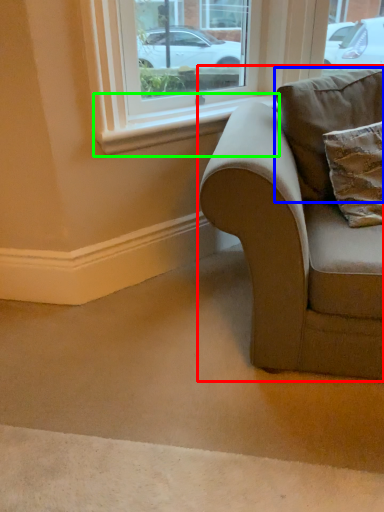
Question: Which is farther away from studio couch (highlighted by a red box)? pillow (highlighted by a blue box) or window sill (highlighted by a green box)?

Choices:
 (A) pillow
 (B) window sill

Answer: (B)